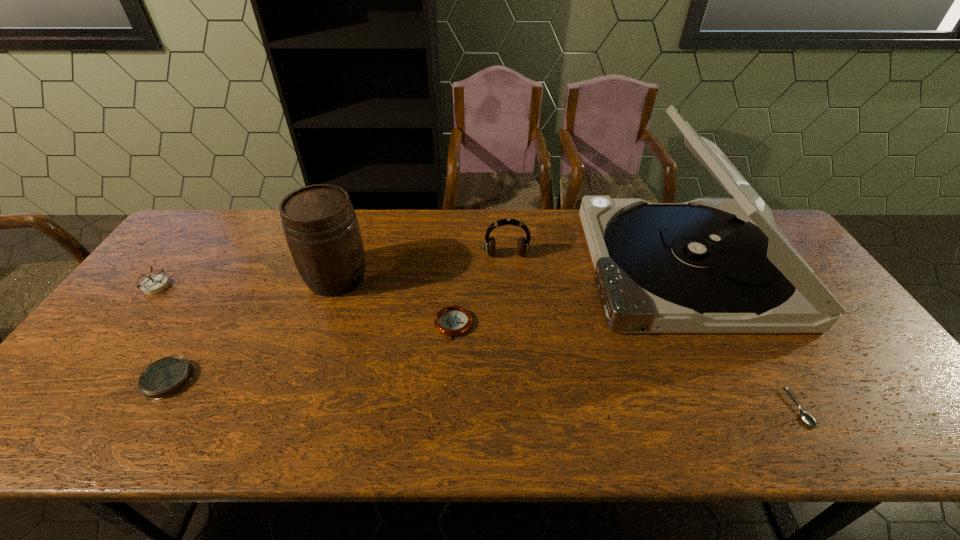
In order to click on free space located on the left of the shortest object in this screenshot , I will do `click(627, 408)`.

Where is `CD player that is at the far edge`? The width and height of the screenshot is (960, 540). CD player that is at the far edge is located at coordinates (708, 265).

Locate an element on the screen. headset situated at the far edge is located at coordinates (523, 244).

Image resolution: width=960 pixels, height=540 pixels. What are the coordinates of `object at the near edge` in the screenshot? It's located at (807, 418).

Identify the location of object present at the left edge. (155, 284).

I want to click on object present at the right edge, so click(708, 265).

Identify the location of object that is positioned at the far right corner. (708, 265).

You are a GUI agent. You are given a task and a screenshot of the screen. Output one action in this format:
    pyautogui.click(x=<x>, y=<y>)
    Task: Click on the blank space at the far edge of the desktop
    Image resolution: width=960 pixels, height=540 pixels.
    Given the screenshot: What is the action you would take?
    pyautogui.click(x=550, y=219)

Image resolution: width=960 pixels, height=540 pixels. In the image, there is a desktop. In order to click on vacant space at the near edge in this screenshot , I will do `click(860, 442)`.

You are a GUI agent. You are given a task and a screenshot of the screen. Output one action in this format:
    pyautogui.click(x=<x>, y=<y>)
    Task: Click on the vacant area at the left edge
    This screenshot has width=960, height=540.
    Given the screenshot: What is the action you would take?
    pyautogui.click(x=126, y=340)